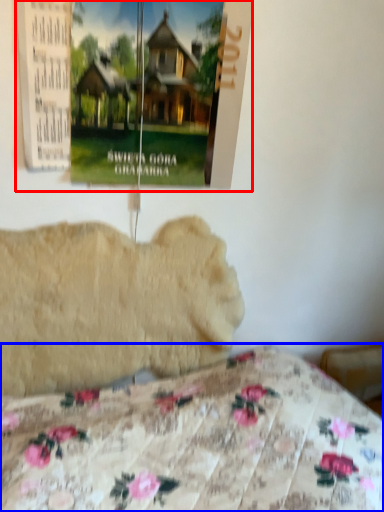
Question: Which point is further to the camera, poster page (highlighted by a red box) or bed (highlighted by a blue box)?

Choices:
 (A) poster page
 (B) bed

Answer: (A)